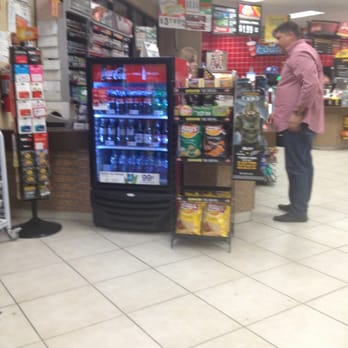
Where is `background red tiled wall`? The height and width of the screenshot is (348, 348). background red tiled wall is located at coordinates (235, 47), (256, 61), (324, 59), (226, 45).